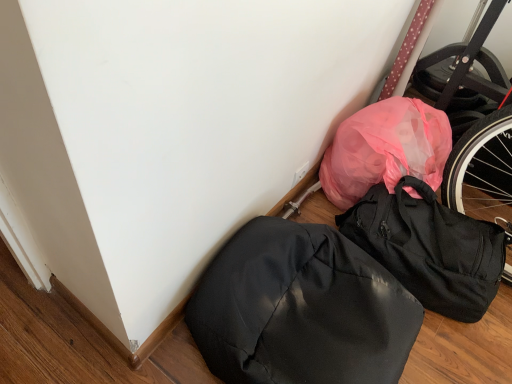
Question: Choose the correct answer: Is matte black backpack at lower right, which is counted as the first backpack, starting from the right, inside glossy black backpack at lower right, the 2th backpack viewed from the right, or outside it?

Choices:
 (A) inside
 (B) outside

Answer: (B)

Question: Is matte black backpack at lower right, the second backpack when ordered from left to right, to the left or to the right of glossy black backpack at lower right, which is counted as the first backpack, starting from the left, in the image?

Choices:
 (A) right
 (B) left

Answer: (A)

Question: Is point (391, 271) positioned closer to the camera than point (338, 249)?

Choices:
 (A) farther
 (B) closer

Answer: (A)

Question: From their relative heights in the image, would you say glossy black backpack at lower right, which is counted as the first backpack, starting from the left, is taller or shorter than matte black backpack at lower right, the second backpack when ordered from left to right?

Choices:
 (A) short
 (B) tall

Answer: (A)

Question: In terms of width, does glossy black backpack at lower right, which is counted as the first backpack, starting from the left, look wider or thinner when compared to matte black backpack at lower right, which is counted as the first backpack, starting from the right?

Choices:
 (A) wide
 (B) thin

Answer: (A)

Question: Considering the positions of glossy black backpack at lower right, the 2th backpack viewed from the right, and matte black backpack at lower right, the second backpack when ordered from left to right, in the image, is glossy black backpack at lower right, the 2th backpack viewed from the right, bigger or smaller than matte black backpack at lower right, the second backpack when ordered from left to right,?

Choices:
 (A) big
 (B) small

Answer: (A)

Question: From a real-world perspective, is glossy black backpack at lower right, the 2th backpack viewed from the right, physically located above or below matte black backpack at lower right, the second backpack when ordered from left to right?

Choices:
 (A) above
 (B) below

Answer: (A)